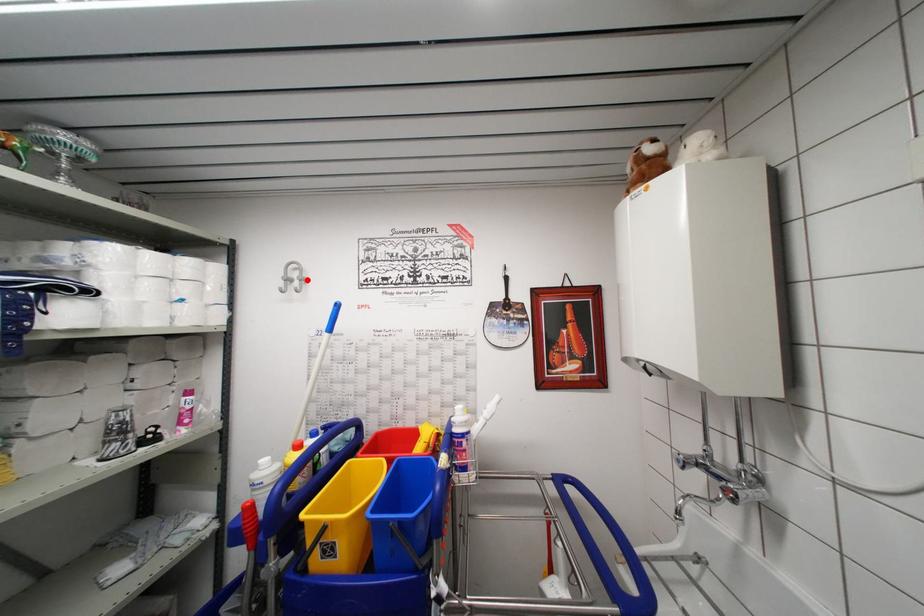
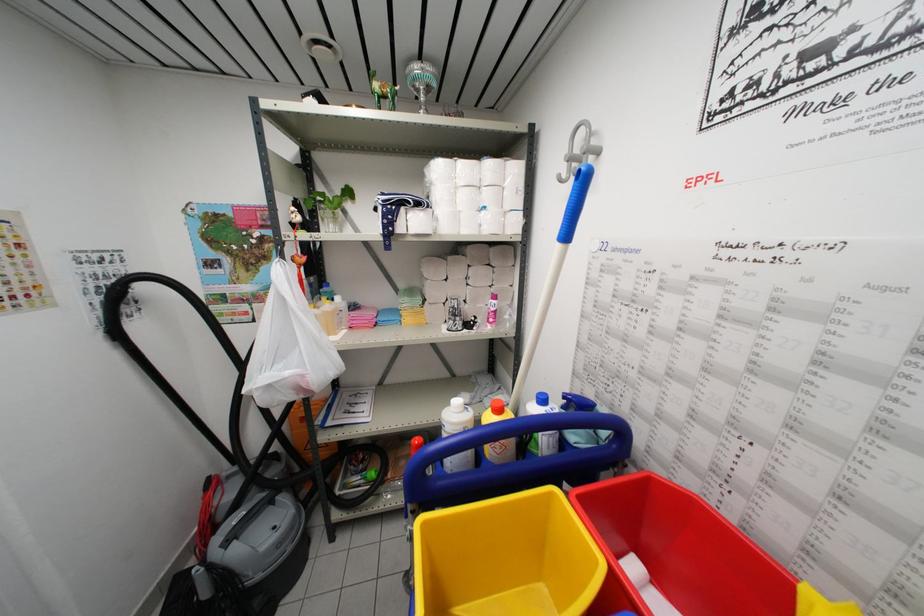
Locate, in the second image, the point that corresponds to the highlighted location in the first image.

(597, 148)